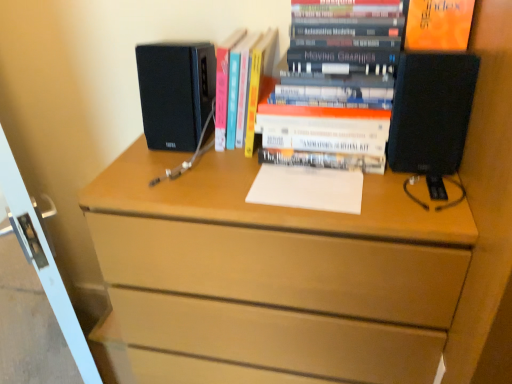
Identify the location of vacant space to the right of white paper at center. (392, 189).